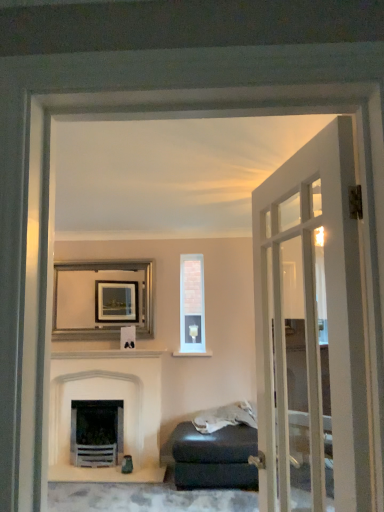
What is the approximate width of white glass door at right?

It is 17.27 centimeters.

Measure the distance between matte black ottoman at lower right and camera.

They are 11.42 feet apart.

What do you see at coordinates (192, 306) in the screenshot? The width and height of the screenshot is (384, 512). I see `clear glass window at center` at bounding box center [192, 306].

Image resolution: width=384 pixels, height=512 pixels. What do you see at coordinates (107, 399) in the screenshot? I see `white stone fireplace at center` at bounding box center [107, 399].

At what (x,y) coordinates should I click in order to perform the action: click on white stone fireplace at center. Please return your answer as a coordinate pair (x, y). Looking at the image, I should click on (107, 399).

At what (x,y) coordinates should I click in order to perform the action: click on white glass door at right. Please return your answer as a coordinate pair (x, y). Looking at the image, I should click on tap(310, 330).

Which is farther, (227,439) or (75,298)?

The point (75,298) is farther from the camera.

Is matte black ottoman at lower right facing towards silver metallic picture frame at upper center?

No, matte black ottoman at lower right is not aimed at silver metallic picture frame at upper center.

From the picture: Who is more distant, matte black ottoman at lower right or silver metallic picture frame at upper center?

silver metallic picture frame at upper center is further from the camera.

Is white glass door at right spatially inside gray leather ottoman at lower right, or outside of it?

The correct answer is: outside.

Considering the positions of objects white glass door at right and gray leather ottoman at lower right in the image provided, who is more to the left, white glass door at right or gray leather ottoman at lower right?

white glass door at right is more to the left.

From a real-world perspective, does white glass door at right stand above gray leather ottoman at lower right?

Indeed, from a real-world perspective, white glass door at right stands above gray leather ottoman at lower right.

Considering the sizes of objects clear glass window at center and white glass door at right in the image provided, who is shorter, clear glass window at center or white glass door at right?

Standing shorter between the two is clear glass window at center.

In the scene shown: Between clear glass window at center and white glass door at right, which one is positioned behind?

clear glass window at center is behind.

Are clear glass window at center and white glass door at right making contact?

No, clear glass window at center is not beside white glass door at right.

Considering the relative positions of clear glass window at center and white glass door at right in the image provided, is clear glass window at center to the right of white glass door at right from the viewer's perspective?

In fact, clear glass window at center is to the left of white glass door at right.

Is gray leather ottoman at lower right in front of or behind matte black ottoman at lower right in the image?

Visually, gray leather ottoman at lower right is located behind matte black ottoman at lower right.

Is gray leather ottoman at lower right in contact with matte black ottoman at lower right?

No, gray leather ottoman at lower right is not in contact with matte black ottoman at lower right.

From a real-world perspective, is gray leather ottoman at lower right located beneath matte black ottoman at lower right?

No, from a real-world perspective, gray leather ottoman at lower right is not under matte black ottoman at lower right.

From a real-world perspective, is gray leather ottoman at lower right physically located above or below white glass door at right?

gray leather ottoman at lower right is situated lower than white glass door at right in the real world.

Consider the image. Considering the sizes of objects gray leather ottoman at lower right and white glass door at right in the image provided, who is thinner, gray leather ottoman at lower right or white glass door at right?

white glass door at right is thinner.

Which is correct: gray leather ottoman at lower right is inside white glass door at right, or outside of it?

gray leather ottoman at lower right lies outside white glass door at right.

In the scene shown: From the image's perspective, is gray leather ottoman at lower right above or below white glass door at right?

Clearly, from the image's perspective, gray leather ottoman at lower right is below white glass door at right.

Could you tell me if silver metallic picture frame at upper center is facing clear glass window at center?

No, silver metallic picture frame at upper center is not aimed at clear glass window at center.

Would you say silver metallic picture frame at upper center is to the left or to the right of clear glass window at center in the picture?

silver metallic picture frame at upper center is positioned on clear glass window at center's left side.

Who is more distant, silver metallic picture frame at upper center or clear glass window at center?

clear glass window at center is behind.

Does silver metallic picture frame at upper center have a lesser height compared to clear glass window at center?

Correct, silver metallic picture frame at upper center is not as tall as clear glass window at center.

Would you say clear glass window at center is a long distance from gray leather ottoman at lower right?

clear glass window at center is actually quite close to gray leather ottoman at lower right.

Is point (203, 352) closer to camera compared to point (251, 410)?

No, (203, 352) is further to viewer.

Identify the location of studio couch located in front of the silver metallic picture frame at upper center. The width and height of the screenshot is (384, 512). click(215, 451).

You are a GUI agent. You are given a task and a screenshot of the screen. Output one action in this format:
    pyautogui.click(x=<x>, y=<y>)
    Task: Click on the door on the left of gray leather ottoman at lower right
    Image resolution: width=384 pixels, height=512 pixels.
    Given the screenshot: What is the action you would take?
    pyautogui.click(x=310, y=330)

Looking at the image, which one is located closer to clear glass window at center, white glass door at right or matte black ottoman at lower right?

The object closer to clear glass window at center is matte black ottoman at lower right.

Looking at the image, which one is located further to gray leather ottoman at lower right, clear glass window at center or white stone fireplace at center?

clear glass window at center is further to gray leather ottoman at lower right.

When comparing their distances from white glass door at right, does clear glass window at center or matte black ottoman at lower right seem closer?

matte black ottoman at lower right lies closer to white glass door at right than the other object.

When comparing their distances from gray leather ottoman at lower right, does silver metallic picture frame at upper center or white stone fireplace at center seem further?

Based on the image, silver metallic picture frame at upper center appears to be further to gray leather ottoman at lower right.

When comparing their distances from white glass door at right, does white stone fireplace at center or silver metallic picture frame at upper center seem closer?

The object closer to white glass door at right is white stone fireplace at center.

Estimate the real-world distances between objects in this image. Which object is closer to matte black ottoman at lower right, white stone fireplace at center or gray leather ottoman at lower right?

gray leather ottoman at lower right is positioned closer to the anchor matte black ottoman at lower right.

Based on their spatial positions, is clear glass window at center or silver metallic picture frame at upper center further from matte black ottoman at lower right?

silver metallic picture frame at upper center lies further to matte black ottoman at lower right than the other object.

Estimate the real-world distances between objects in this image. Which object is further from gray leather ottoman at lower right, white stone fireplace at center or silver metallic picture frame at upper center?

silver metallic picture frame at upper center is further to gray leather ottoman at lower right.

You are a GUI agent. You are given a task and a screenshot of the screen. Output one action in this format:
    pyautogui.click(x=<x>, y=<y>)
    Task: Click on the studio couch between white glass door at right and gray leather ottoman at lower right along the z-axis
    The width and height of the screenshot is (384, 512).
    Given the screenshot: What is the action you would take?
    pyautogui.click(x=215, y=451)

Where is `material between white glass door at right and white stone fireplace at center from front to back`? The height and width of the screenshot is (512, 384). material between white glass door at right and white stone fireplace at center from front to back is located at coordinates (225, 417).

Find the location of `window between silver metallic picture frame at upper center and matte black ottoman at lower right from top to bottom`. window between silver metallic picture frame at upper center and matte black ottoman at lower right from top to bottom is located at coordinates (192, 306).

The width and height of the screenshot is (384, 512). In order to click on fireplace between silver metallic picture frame at upper center and matte black ottoman at lower right from top to bottom in this screenshot , I will do `click(107, 399)`.